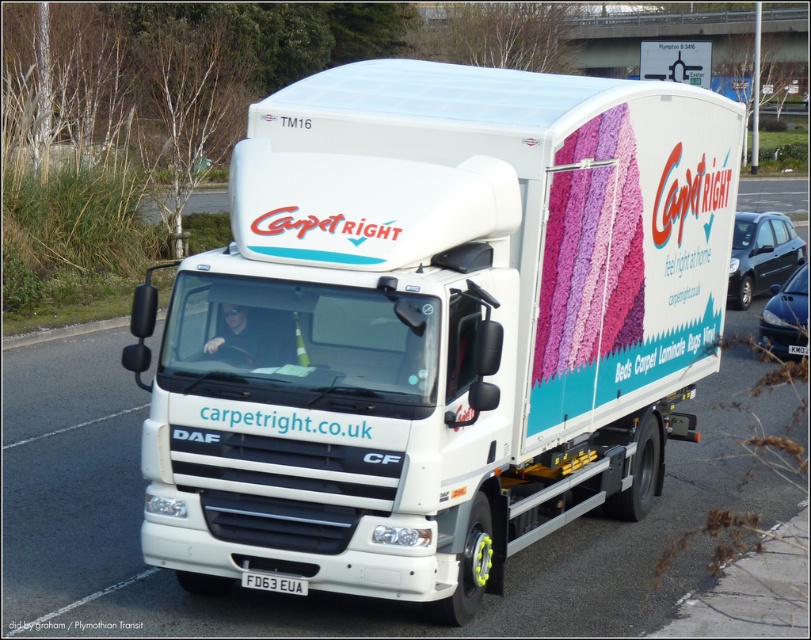
Between point (783, 216) and point (803, 330), which one is positioned behind?

Point (783, 216)

What do you see at coordinates (762, 253) in the screenshot?
I see `metallic blue sedan at right` at bounding box center [762, 253].

Where is `metallic blue sedan at right`? This screenshot has height=640, width=811. metallic blue sedan at right is located at coordinates pyautogui.click(x=762, y=253).

Locate an element on the screen. The width and height of the screenshot is (811, 640). metallic blue sedan at right is located at coordinates (762, 253).

At what (x,y) coordinates should I click in order to perform the action: click on metallic blue car at right. Please return your answer as a coordinate pair (x, y). The height and width of the screenshot is (640, 811). Looking at the image, I should click on (784, 314).

Does metallic blue car at right have a lesser width compared to black plastic license plate at center?

In fact, metallic blue car at right might be wider than black plastic license plate at center.

This screenshot has height=640, width=811. What do you see at coordinates (784, 314) in the screenshot? I see `metallic blue car at right` at bounding box center [784, 314].

Find the location of a particular element. Image resolution: width=811 pixels, height=640 pixels. metallic blue car at right is located at coordinates (784, 314).

Is white matte trailer truck at center further to camera compared to metallic blue car at right?

No, white matte trailer truck at center is closer to the viewer.

Locate an element on the screen. The width and height of the screenshot is (811, 640). white matte trailer truck at center is located at coordinates (434, 326).